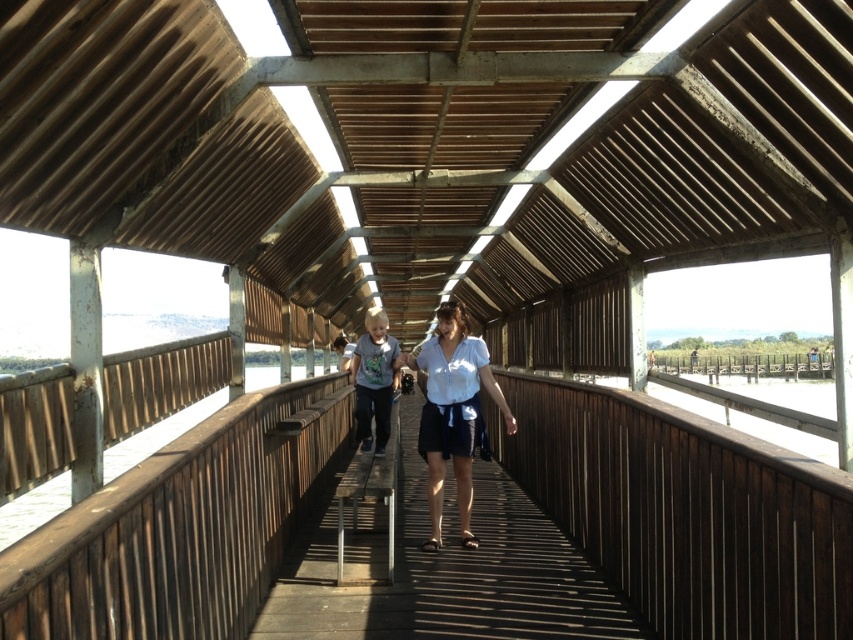
You are standing on the wooden walkway and see two shirts hanging from the railings at the center. The light gray cotton shirt at center and the matte white shirt at center. Which shirt is closer to you?

The light gray cotton shirt at center is closer to you because it is in front of the matte white shirt at center.

In the scene shown: You are standing on the wooden walkway and see two shirts hanging from the railings. The white cotton shirt at center and the light gray cotton shirt at center. Which shirt is closer to you?

The white cotton shirt at center is closer to the viewer than the light gray cotton shirt at center.